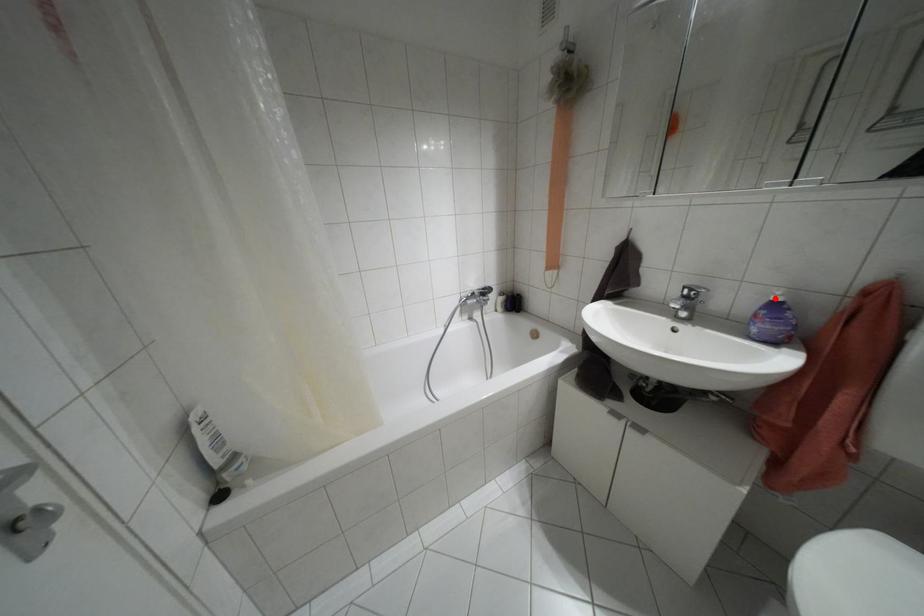
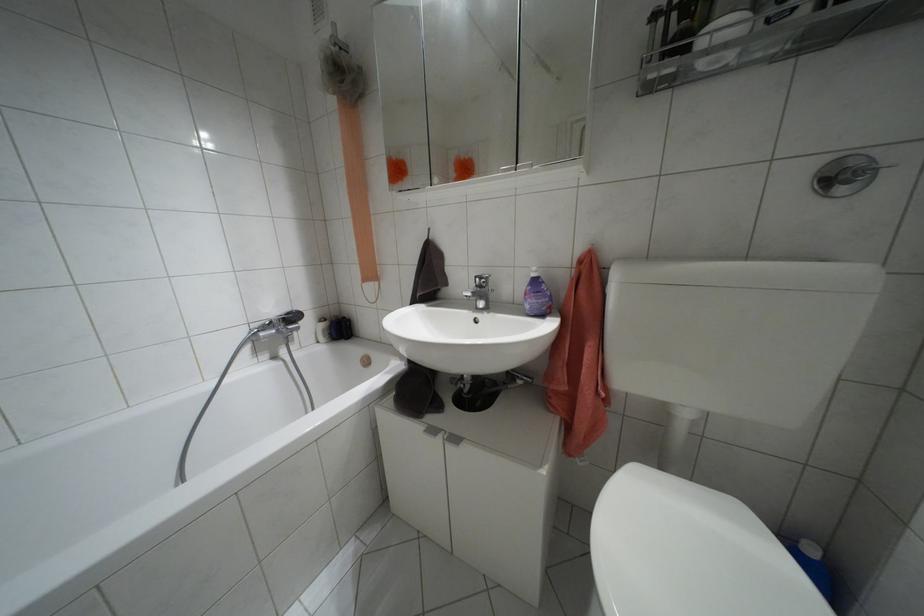
In the second image, find the point that corresponds to the highlighted location in the first image.

(532, 274)